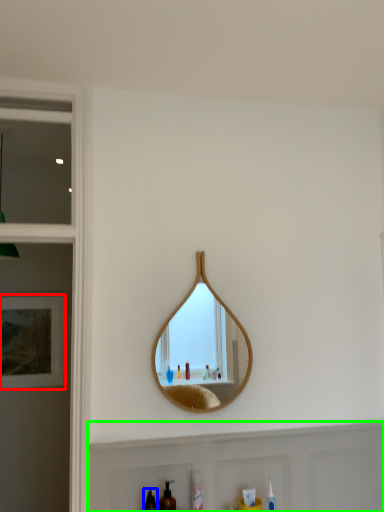
Question: Estimate the real-world distances between objects in this image. Which object is farther from picture frame (highlighted by a red box), mouthwash (highlighted by a blue box) or cabinet (highlighted by a green box)?

Choices:
 (A) mouthwash
 (B) cabinet

Answer: (A)